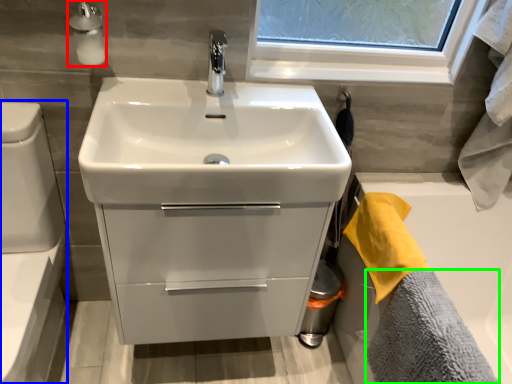
Question: Which object is the farthest from soap dispenser (highlighted by a red box)? Choose among these: toilet bowl (highlighted by a blue box) or bath towel (highlighted by a green box).

Choices:
 (A) toilet bowl
 (B) bath towel

Answer: (B)